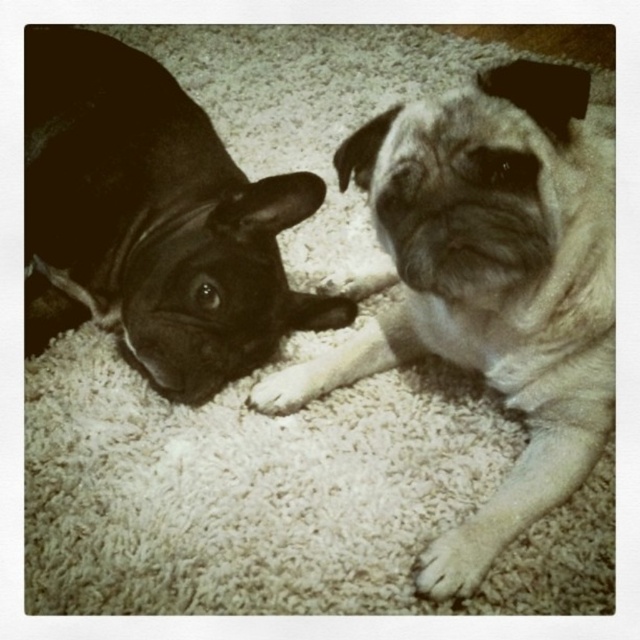
Between white fur at lower right and white fur at center, which one has less height?

With less height is white fur at center.

Does point (432, 589) lie in front of point (273, 384)?

Yes.

Where is `white fur at lower right`? Image resolution: width=640 pixels, height=640 pixels. white fur at lower right is located at coordinates (458, 560).

The height and width of the screenshot is (640, 640). In order to click on white fur at lower right in this screenshot , I will do `click(458, 560)`.

Which is above, fuzzy beige pug at center or shiny black dog at left?

Positioned higher is shiny black dog at left.

Which is behind, point (442, 97) or point (237, 193)?

The point (237, 193) is more distant.

Locate an element on the screen. This screenshot has width=640, height=640. fuzzy beige pug at center is located at coordinates pos(499,260).

Who is lower down, shiny black dog at left or white fur at center?

white fur at center is lower down.

Is shiny black dog at left above white fur at center?

Indeed, shiny black dog at left is positioned over white fur at center.

Image resolution: width=640 pixels, height=640 pixels. Describe the element at coordinates (154, 220) in the screenshot. I see `shiny black dog at left` at that location.

Identify the location of shiny black dog at left. (154, 220).